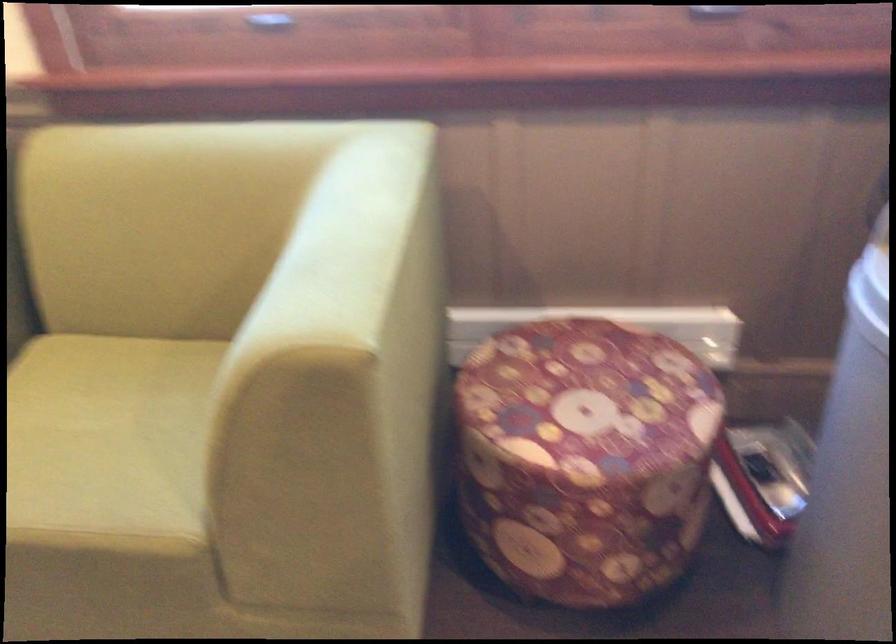
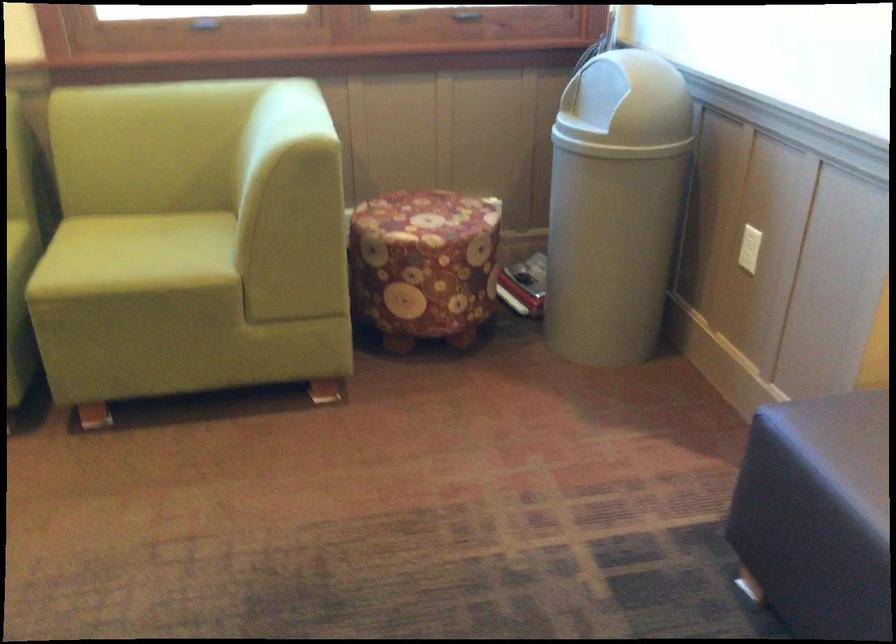
Which direction would the cameraman need to move to produce the second image?

The cameraman walked toward left, backward.